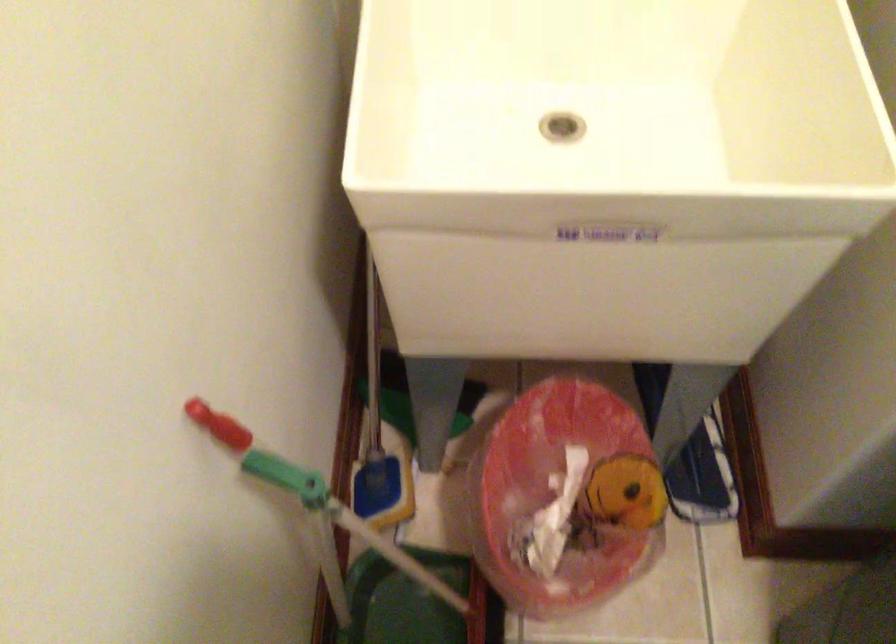
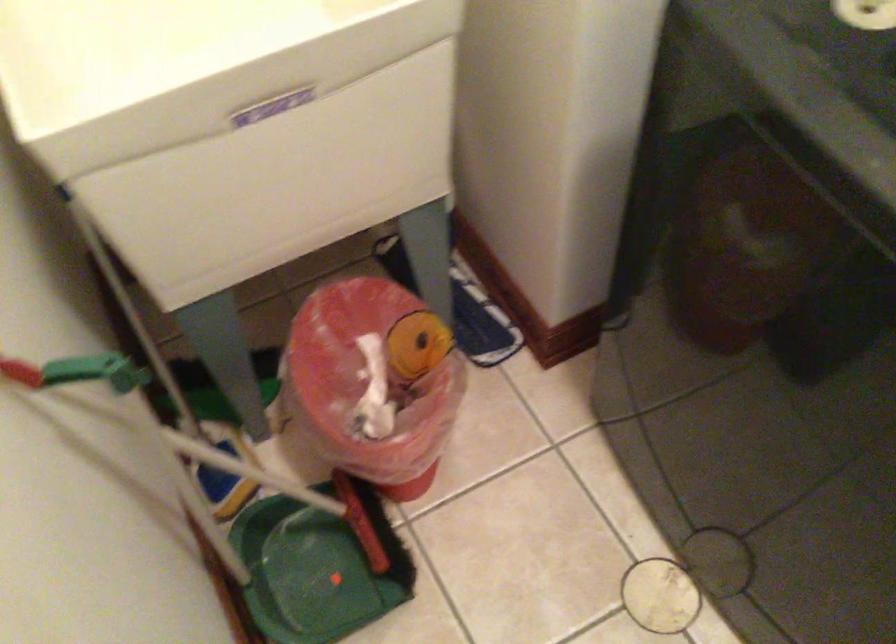
Where in the second image is the point corresponding to point 376,545 from the first image?

(228, 462)